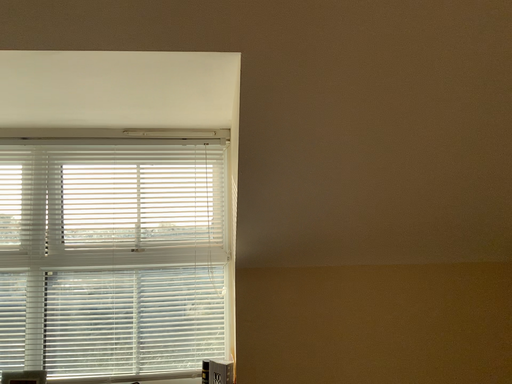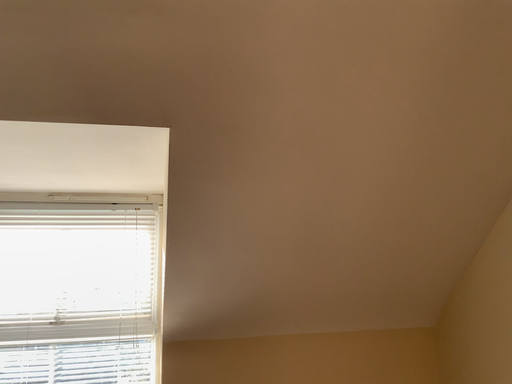
Question: How did the camera likely rotate when shooting the video?

Choices:
 (A) rotated right
 (B) rotated left

Answer: (A)